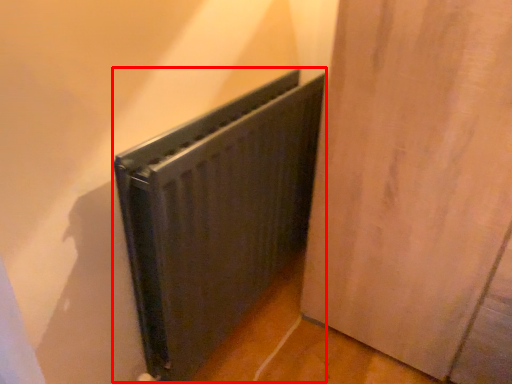
Question: Where is radiator (annotated by the red box) located in relation to door in the image?

Choices:
 (A) left
 (B) right

Answer: (A)